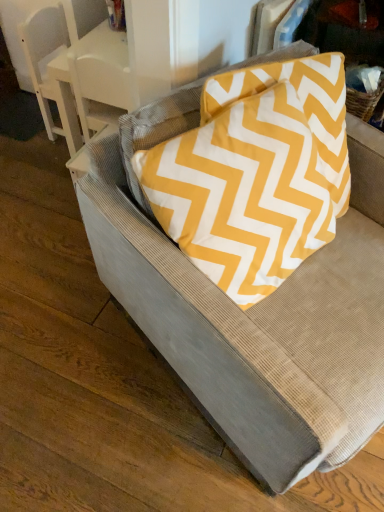
Question: Is yellow zigzag fabric pillow at upper right beside textured gray armchair at upper left?

Choices:
 (A) no
 (B) yes

Answer: (A)

Question: Is yellow zigzag fabric pillow at upper right facing away from textured gray armchair at upper left?

Choices:
 (A) no
 (B) yes

Answer: (B)

Question: Is yellow zigzag fabric pillow at upper right shorter than textured gray armchair at upper left?

Choices:
 (A) yes
 (B) no

Answer: (A)

Question: Can you confirm if yellow zigzag fabric pillow at upper right is wider than textured gray armchair at upper left?

Choices:
 (A) no
 (B) yes

Answer: (A)

Question: Can you confirm if yellow zigzag fabric pillow at upper right is thinner than textured gray armchair at upper left?

Choices:
 (A) yes
 (B) no

Answer: (A)

Question: Does yellow zigzag fabric pillow at upper right come in front of textured gray armchair at upper left?

Choices:
 (A) yes
 (B) no

Answer: (A)

Question: Considering the relative sizes of textured gray armchair at upper left and yellow zigzag fabric pillow at upper right in the image provided, is textured gray armchair at upper left wider than yellow zigzag fabric pillow at upper right?

Choices:
 (A) no
 (B) yes

Answer: (B)

Question: Does textured gray armchair at upper left appear on the right side of yellow zigzag fabric pillow at upper right?

Choices:
 (A) no
 (B) yes

Answer: (A)

Question: Can you confirm if textured gray armchair at upper left is positioned to the left of yellow zigzag fabric pillow at upper right?

Choices:
 (A) no
 (B) yes

Answer: (B)

Question: Is textured gray armchair at upper left directly adjacent to yellow zigzag fabric pillow at upper right?

Choices:
 (A) yes
 (B) no

Answer: (B)

Question: From a real-world perspective, does textured gray armchair at upper left stand above yellow zigzag fabric pillow at upper right?

Choices:
 (A) yes
 (B) no

Answer: (B)

Question: Is textured gray armchair at upper left positioned with its back to yellow zigzag fabric pillow at upper right?

Choices:
 (A) no
 (B) yes

Answer: (A)

Question: From the image's perspective, would you say white glossy table at upper left is shown under textured gray cushion at center?

Choices:
 (A) no
 (B) yes

Answer: (A)